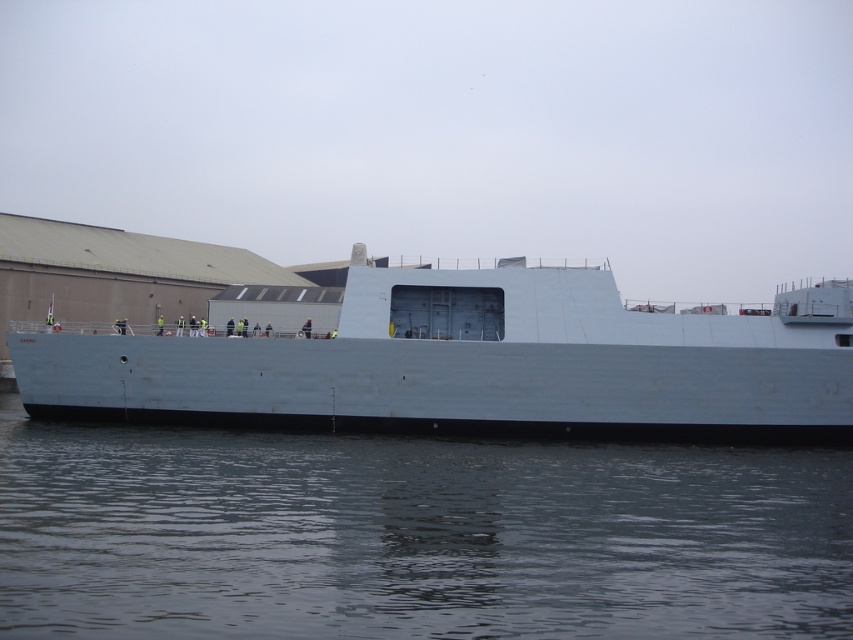
You are a photographer standing on the dock and want to capture both the gray matte water at lower center and the white matte ship at center in a single frame. Which object will appear narrower in the photo?

The gray matte water at lower center will appear narrower in the photo because it is thinner than the white matte ship at center.

You are a photographer trying to capture the white matte ship at center from the dock. You notice the gray matte water at lower center is blocking your view. Is there a way to adjust your position to see the ship without the water in the frame?

Since the gray matte water at lower center is in front of the white matte ship at center, you can move to a higher position or angle your camera upwards to avoid the water blocking the view of the ship.